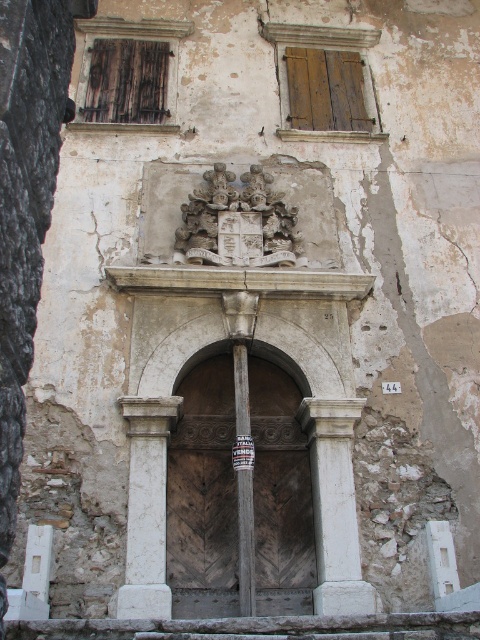
Image resolution: width=480 pixels, height=640 pixels. What do you see at coordinates (237, 493) in the screenshot?
I see `wooden at center` at bounding box center [237, 493].

Between wooden at center and white marble column at center, which one is positioned higher?

wooden at center is above.

Find the location of `wooden at center`. wooden at center is located at coordinates 237,493.

In the scene shown: Does wooden at center have a larger size compared to white stone coat of arms at center?

Indeed, wooden at center has a larger size compared to white stone coat of arms at center.

Does wooden at center have a lesser height compared to white stone coat of arms at center?

In fact, wooden at center may be taller than white stone coat of arms at center.

Find the location of a particular element. The width and height of the screenshot is (480, 640). wooden at center is located at coordinates (237, 493).

Locate an element on the screen. The image size is (480, 640). wooden at center is located at coordinates (237, 493).

This screenshot has height=640, width=480. Describe the element at coordinates (237, 493) in the screenshot. I see `wooden at center` at that location.

At what (x,y) coordinates should I click in order to perform the action: click on wooden at center. Please return your answer as a coordinate pair (x, y). This screenshot has width=480, height=640. Looking at the image, I should click on (237, 493).

Between point (265, 568) and point (244, 604), which one is positioned in front?

Positioned in front is point (244, 604).

This screenshot has width=480, height=640. What are the coordinates of `wooden at center` in the screenshot? It's located at (237, 493).